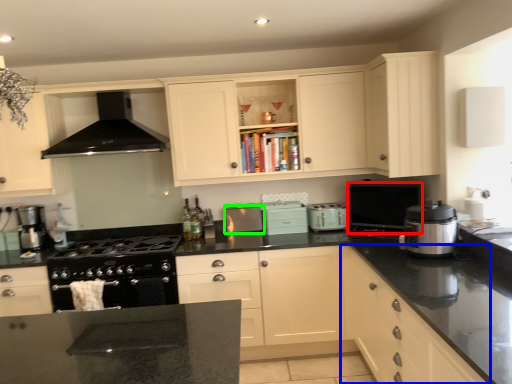
Question: Considering the real-world distances, which object is farthest from appliance (highlighted by a red box)? cabinetry (highlighted by a blue box) or kitchen appliance (highlighted by a green box)?

Choices:
 (A) cabinetry
 (B) kitchen appliance

Answer: (B)